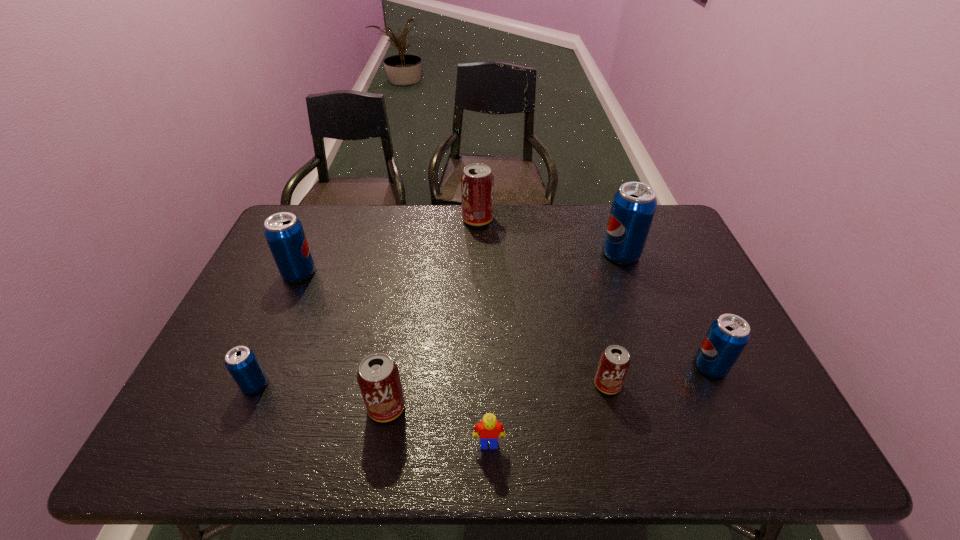
I want to click on the tallest object, so (x=634, y=204).

This screenshot has height=540, width=960. In order to click on the second object from right to left in this screenshot , I will do `click(634, 204)`.

The image size is (960, 540). What are the coordinates of `the farthest soda can` in the screenshot? It's located at [x=477, y=182].

I want to click on the fourth soda can from right to left, so click(x=477, y=182).

Locate an element on the screen. the second biggest blue pop soda is located at coordinates (284, 233).

Locate an element on the screen. the rightmost blue pop soda is located at coordinates (728, 335).

Find the location of a particular element. This screenshot has height=540, width=960. the third biggest blue pop soda is located at coordinates (728, 335).

Where is `the leftmost red soda can`? This screenshot has height=540, width=960. the leftmost red soda can is located at coordinates (378, 376).

Find the location of `the second smallest red soda can`. the second smallest red soda can is located at coordinates (378, 376).

This screenshot has height=540, width=960. Find the location of `the smallest blue pop soda`. the smallest blue pop soda is located at coordinates (241, 362).